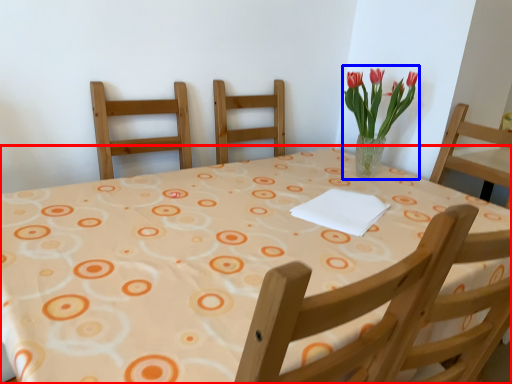
Question: Which object is further to the camera taking this photo, table (highlighted by a red box) or floral arrangement (highlighted by a blue box)?

Choices:
 (A) table
 (B) floral arrangement

Answer: (B)